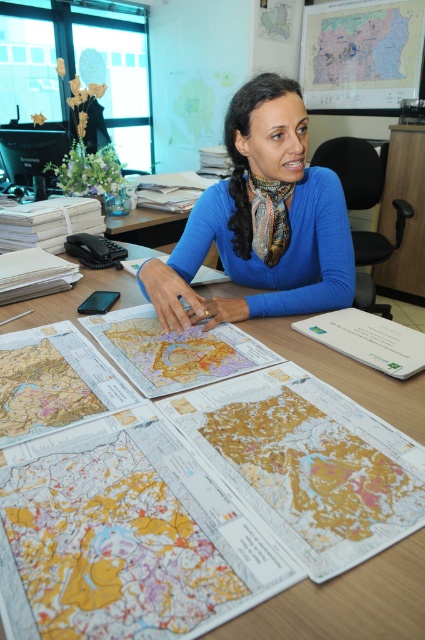
Is point (314, 177) behind point (295, 616)?

Yes, it is behind point (295, 616).

Identify the location of blue silk scarf at center. (260, 220).